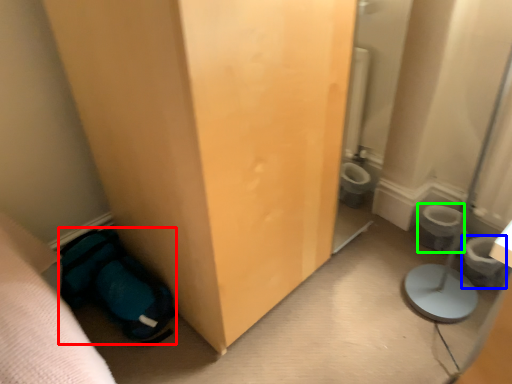
Question: Considering the real-world distances, which object is closest to sleeping bag (highlighted by a red box)? potty (highlighted by a blue box) or toilet bowl (highlighted by a green box).

Choices:
 (A) potty
 (B) toilet bowl

Answer: (B)